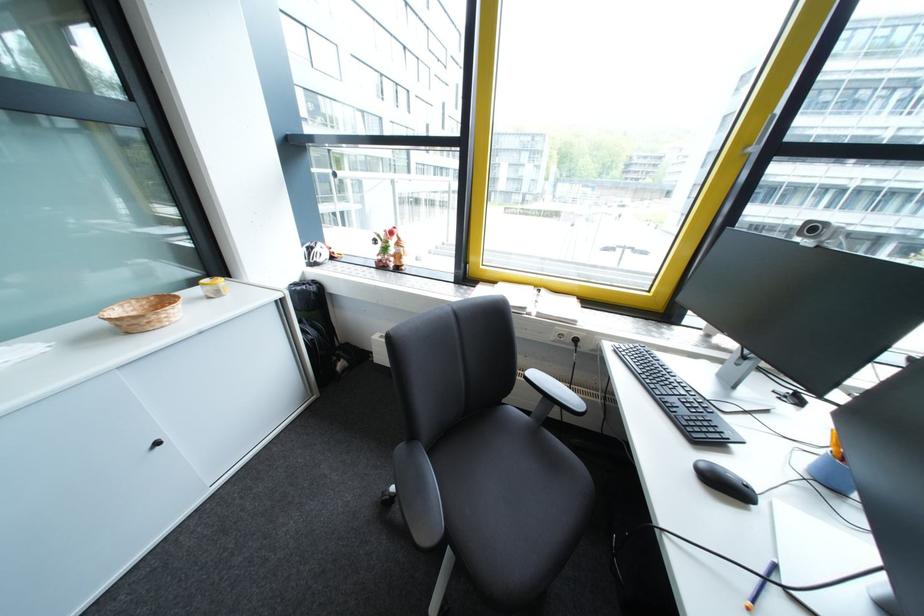
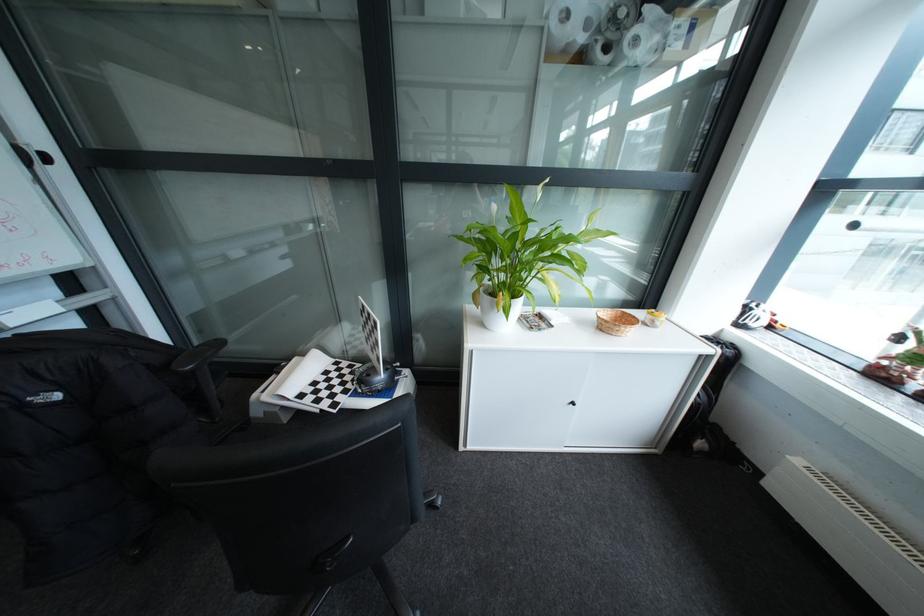
Question: Based on the continuous images, in which direction is the camera rotating? Reply with the corresponding letter.

Choices:
 (A) Left
 (B) Right
 (C) Up
 (D) Down

Answer: (A)